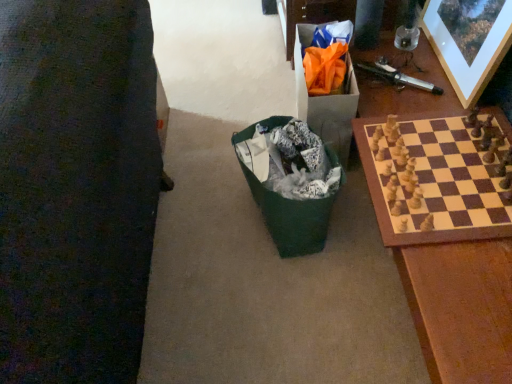
Image resolution: width=512 pixels, height=384 pixels. Describe the element at coordinates (436, 176) in the screenshot. I see `wooden chess set at right` at that location.

I want to click on green fabric bag at center, so click(291, 219).

From the image's perspective, is orange paper bag at upper right located beneath green fabric bag at center?

Incorrect, from the image's perspective, orange paper bag at upper right is higher than green fabric bag at center.

Between orange paper bag at upper right and green fabric bag at center, which one has less height?

With less height is green fabric bag at center.

Where is `cardboard box that appears on the right of green fabric bag at center`? The width and height of the screenshot is (512, 384). cardboard box that appears on the right of green fabric bag at center is located at coordinates click(x=326, y=100).

Which object is closer to the camera taking this photo, orange paper bag at upper right or green fabric bag at center?

green fabric bag at center.

Can orange paper bag at upper right be found inside green fabric bag at center?

No, orange paper bag at upper right is not inside green fabric bag at center.

From the image's perspective, would you say green fabric bag at center is shown under orange paper bag at upper right?

Correct, green fabric bag at center appears lower than orange paper bag at upper right in the image.

Is green fabric bag at center oriented away from orange paper bag at upper right?

No, orange paper bag at upper right is not at the back of green fabric bag at center.

Locate an element on the screen. recycling bin below the orange paper bag at upper right (from a real-world perspective) is located at coordinates (291, 219).

Which is behind, wooden chess set at right or green fabric bag at center?

green fabric bag at center is more distant.

From a real-world perspective, does wooden chess set at right sit lower than green fabric bag at center?

No, from a real-world perspective, wooden chess set at right is not below green fabric bag at center.

Is wooden chess set at right thinner than green fabric bag at center?

Incorrect, the width of wooden chess set at right is not less than that of green fabric bag at center.

Image resolution: width=512 pixels, height=384 pixels. I want to click on board game positioned vertically above the green fabric bag at center (from a real-world perspective), so click(x=436, y=176).

In the scene shown: What's the angular difference between orange paper bag at upper right and wooden chess set at right's facing directions?

The angular difference between orange paper bag at upper right and wooden chess set at right is 0.0185 degrees.

From a real-world perspective, who is located lower, orange paper bag at upper right or wooden chess set at right?

From a 3D spatial view, orange paper bag at upper right is below.

From the picture: From the image's perspective, which one is positioned lower, orange paper bag at upper right or wooden chess set at right?

wooden chess set at right, from the image's perspective.

Is orange paper bag at upper right next to wooden chess set at right and touching it?

No.

Is wooden picture frame at upper right further to camera compared to green fabric bag at center?

No, wooden picture frame at upper right is closer to the camera.

In the scene shown: Which is correct: wooden picture frame at upper right is inside green fabric bag at center, or outside of it?

wooden picture frame at upper right lies outside green fabric bag at center.

The width and height of the screenshot is (512, 384). In order to click on picture frame above the green fabric bag at center (from the image's perspective) in this screenshot , I will do `click(468, 41)`.

Considering the relative sizes of orange paper bag at upper right and wooden picture frame at upper right in the image provided, is orange paper bag at upper right bigger than wooden picture frame at upper right?

Yes.

Where is `cardboard box on the left of wooden picture frame at upper right`? The image size is (512, 384). cardboard box on the left of wooden picture frame at upper right is located at coordinates (326, 100).

Is orange paper bag at upper right directly adjacent to wooden picture frame at upper right?

No, orange paper bag at upper right is not making contact with wooden picture frame at upper right.

Considering the relative sizes of orange paper bag at upper right and wooden picture frame at upper right in the image provided, is orange paper bag at upper right taller than wooden picture frame at upper right?

Incorrect, the height of orange paper bag at upper right is not larger of that of wooden picture frame at upper right.

Are wooden chess set at right and orange paper bag at upper right making contact?

wooden chess set at right and orange paper bag at upper right are clearly separated.

Based on the photo, considering the relative sizes of wooden chess set at right and orange paper bag at upper right in the image provided, is wooden chess set at right bigger than orange paper bag at upper right?

Incorrect, wooden chess set at right is not larger than orange paper bag at upper right.

Is wooden chess set at right oriented away from orange paper bag at upper right?

That's not correct — wooden chess set at right is not looking away from orange paper bag at upper right.

From the image's perspective, is wooden chess set at right above orange paper bag at upper right?

No.

Locate an element on the screen. Image resolution: width=512 pixels, height=384 pixels. recycling bin on the left of orange paper bag at upper right is located at coordinates click(x=291, y=219).

You are a GUI agent. You are given a task and a screenshot of the screen. Output one action in this format:
    pyautogui.click(x=<x>, y=<y>)
    Task: Click on the cardboard box above the green fabric bag at center (from the image's perspective)
    
    Given the screenshot: What is the action you would take?
    pyautogui.click(x=326, y=100)

Estimate the real-world distances between objects in this image. Which object is closer to green fabric bag at center, orange paper bag at upper right or wooden chess set at right?

orange paper bag at upper right is positioned closer to the anchor green fabric bag at center.

Looking at this image, when comparing their distances from green fabric bag at center, does wooden chess set at right or wooden picture frame at upper right seem further?

wooden picture frame at upper right is further to green fabric bag at center.

Consider the image. From the image, which object appears to be nearer to wooden chess set at right, wooden picture frame at upper right or orange paper bag at upper right?

Based on the image, wooden picture frame at upper right appears to be nearer to wooden chess set at right.

Considering their positions, is green fabric bag at center positioned further to wooden chess set at right than orange paper bag at upper right?

green fabric bag at center.

From the image, which object appears to be farther from green fabric bag at center, wooden picture frame at upper right or orange paper bag at upper right?

Based on the image, wooden picture frame at upper right appears to be further to green fabric bag at center.

When comparing their distances from wooden picture frame at upper right, does green fabric bag at center or orange paper bag at upper right seem closer?

orange paper bag at upper right.

When comparing their distances from wooden picture frame at upper right, does wooden chess set at right or green fabric bag at center seem closer?

Based on the image, wooden chess set at right appears to be nearer to wooden picture frame at upper right.

Estimate the real-world distances between objects in this image. Which object is closer to orange paper bag at upper right, wooden picture frame at upper right or green fabric bag at center?

green fabric bag at center lies closer to orange paper bag at upper right than the other object.

The width and height of the screenshot is (512, 384). I want to click on board game between green fabric bag at center and wooden picture frame at upper right from left to right, so click(436, 176).

The width and height of the screenshot is (512, 384). I want to click on cardboard box between green fabric bag at center and wooden chess set at right, so click(326, 100).

Where is `cardboard box located between green fabric bag at center and wooden picture frame at upper right in the left-right direction`? The image size is (512, 384). cardboard box located between green fabric bag at center and wooden picture frame at upper right in the left-right direction is located at coordinates (326, 100).

Find the location of a particular element. This screenshot has width=512, height=384. cardboard box between wooden picture frame at upper right and wooden chess set at right vertically is located at coordinates (326, 100).